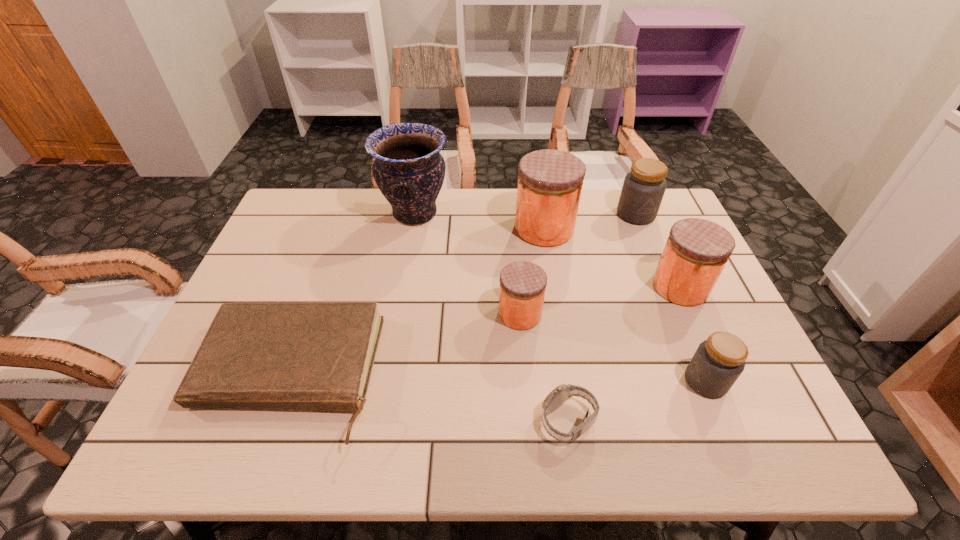
Find the location of `the shortest object`. the shortest object is located at coordinates (291, 356).

At what (x,y) coordinates should I click in order to perform the action: click on vacant space situated 0.250m on the front handle of the pottery. Please return your answer as a coordinate pair (x, y). The height and width of the screenshot is (540, 960). Looking at the image, I should click on (527, 214).

Find the location of `free location located 0.350m on the left of the farthest orange jar`. free location located 0.350m on the left of the farthest orange jar is located at coordinates (403, 228).

Where is `vacant area situated on the surface of the farther gray jar near the warning symbol`? Image resolution: width=960 pixels, height=540 pixels. vacant area situated on the surface of the farther gray jar near the warning symbol is located at coordinates (672, 302).

You are a GUI agent. You are given a task and a screenshot of the screen. Output one action in this format:
    pyautogui.click(x=<x>, y=<y>)
    Task: Click on the vacant position located on the back of the second smallest orange jar
    
    Given the screenshot: What is the action you would take?
    pyautogui.click(x=646, y=209)

Locate an element on the screen. The height and width of the screenshot is (540, 960). free spot located 0.100m on the right of the smallest orange jar is located at coordinates (581, 314).

In order to click on blank space located on the surface of the nearer gray jar near the warning symbol in this screenshot , I will do `click(605, 381)`.

I want to click on vacant region located 0.080m on the surface of the nearer gray jar near the warning symbol, so click(650, 381).

Where is `free space located on the surface of the nearer gray jar near the warning symbol`? Image resolution: width=960 pixels, height=540 pixels. free space located on the surface of the nearer gray jar near the warning symbol is located at coordinates (561, 381).

Find the location of a particular element. vacant space located 0.340m on the face of the white watch is located at coordinates (379, 421).